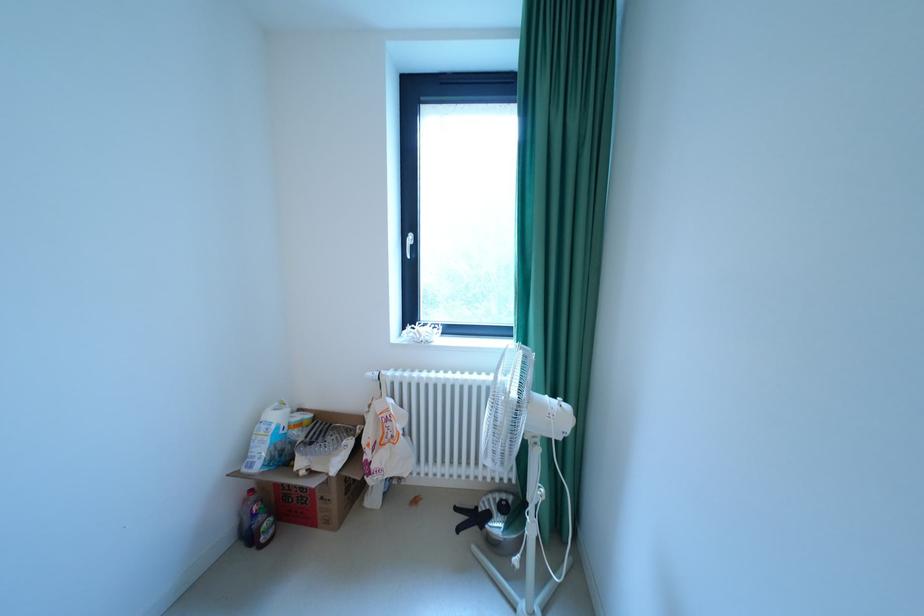
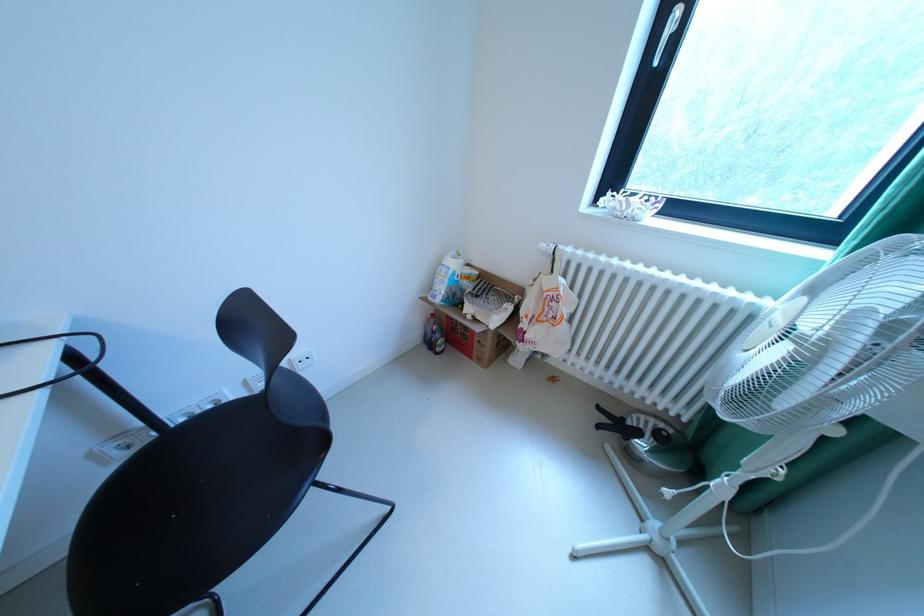
Locate, in the second image, the point that corresponds to [250,527] in the first image.

(435, 334)